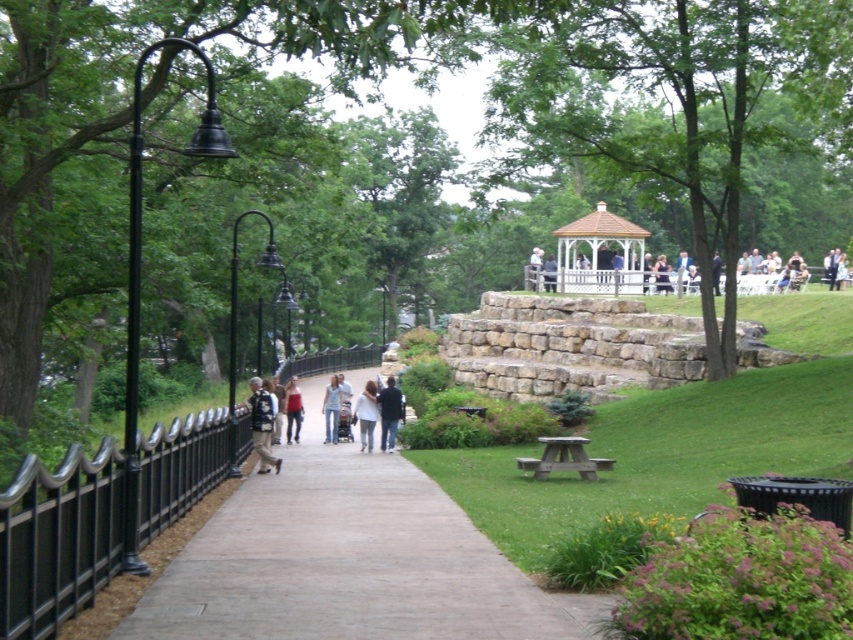
Which is more to the left, green leafy tree at upper center or white wooden gazebo at upper center?

white wooden gazebo at upper center is more to the left.

Between point (733, 280) and point (590, 241), which one is positioned in front?

Positioned in front is point (733, 280).

Which is behind, point (724, 100) or point (596, 209)?

The point (596, 209) is behind.

Locate an element on the screen. This screenshot has width=853, height=640. green leafy tree at upper center is located at coordinates (680, 104).

Is white wooden gazebo at center below matte red shirt at center?

No, white wooden gazebo at center is not below matte red shirt at center.

Can you confirm if white wooden gazebo at center is bigger than matte red shirt at center?

Indeed, white wooden gazebo at center has a larger size compared to matte red shirt at center.

What are the coordinates of `white wooden gazebo at center` in the screenshot? It's located at (602, 280).

Between point (262, 397) and point (366, 436), which one is positioned in front?

Point (262, 397)

The width and height of the screenshot is (853, 640). What do you see at coordinates (260, 424) in the screenshot?
I see `denim jacket at center` at bounding box center [260, 424].

Is point (260, 394) closer to viewer compared to point (373, 419)?

That is True.

The width and height of the screenshot is (853, 640). Identify the location of denim jacket at center. (260, 424).